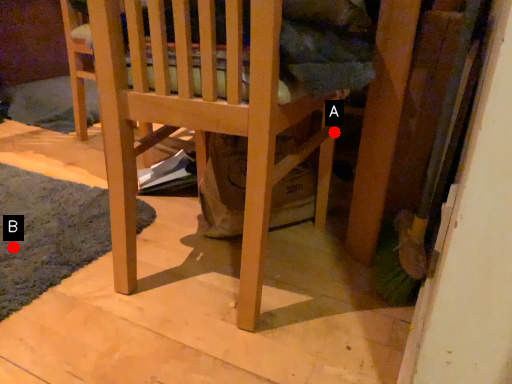
Question: Two points are circled on the image, labeled by A and B beside each circle. Which point is closer to the camera?

Choices:
 (A) A is closer
 (B) B is closer

Answer: (B)